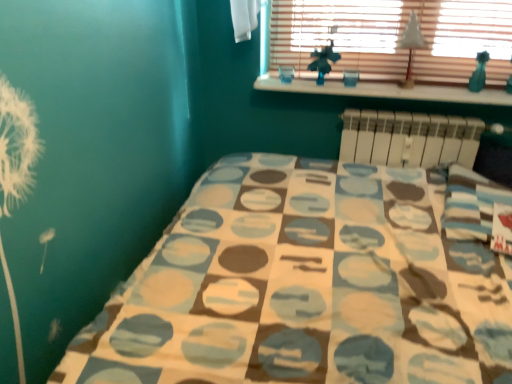
The width and height of the screenshot is (512, 384). I want to click on white paper at upper center, so click(411, 46).

Consider the image. What is the approximate width of white paper at upper center?

white paper at upper center is 2.74 inches in width.

Where is `wooden blinds at upper center`? wooden blinds at upper center is located at coordinates (393, 38).

From the image's perspective, which is above, white plastic radiator at upper right or white wood at upper center?

white wood at upper center appears higher in the image.

Is white plastic radiator at upper right to the left of white wood at upper center from the viewer's perspective?

No, white plastic radiator at upper right is not to the left of white wood at upper center.

Is white plastic radiator at upper right directly adjacent to white wood at upper center?

No, white plastic radiator at upper right is not with white wood at upper center.

Is white plastic radiator at upper right thinner than white wood at upper center?

Indeed, white plastic radiator at upper right has a lesser width compared to white wood at upper center.

Does white wood at upper center contain white plastic radiator at upper right?

No, white plastic radiator at upper right is not a part of white wood at upper center.

In terms of height, does white wood at upper center look taller or shorter compared to white plastic radiator at upper right?

Considering their sizes, white wood at upper center has less height than white plastic radiator at upper right.

Consider the image. Considering the positions of objects white wood at upper center and white plastic radiator at upper right in the image provided, who is behind, white wood at upper center or white plastic radiator at upper right?

Positioned behind is white plastic radiator at upper right.

Find the location of `radiator on the right of white wood at upper center`. radiator on the right of white wood at upper center is located at coordinates (409, 138).

Image resolution: width=512 pixels, height=384 pixels. In order to click on lamp above the white wood at upper center (from the image's perspective) in this screenshot , I will do `click(411, 46)`.

Is white wood at upper center positioned beyond the bounds of white paper at upper center?

white wood at upper center is positioned outside white paper at upper center.

Could you tell me if white wood at upper center is turned towards white paper at upper center?

No, white wood at upper center is not aimed at white paper at upper center.

Is white paper at upper center positioned far away from white plastic radiator at upper right?

They are positioned close to each other.

From the image's perspective, is white paper at upper center above or below white plastic radiator at upper right?

white paper at upper center is above white plastic radiator at upper right.

From a real-world perspective, who is located lower, white paper at upper center or white plastic radiator at upper right?

white plastic radiator at upper right, from a real-world perspective.

Which is behind, wooden blinds at upper center or white wood at upper center?

white wood at upper center.

What's the angular difference between wooden blinds at upper center and white wood at upper center's facing directions?

wooden blinds at upper center and white wood at upper center are facing 0.12 degrees away from each other.

In the scene shown: Can you see wooden blinds at upper center touching white wood at upper center?

wooden blinds at upper center is not next to white wood at upper center, and they're not touching.

Does point (430, 5) lie in front of point (407, 96)?

Yes, point (430, 5) is closer to viewer.

From a real-world perspective, relative to white paper at upper center, is wooden blinds at upper center vertically above or below?

Clearly, from a real-world perspective, wooden blinds at upper center is above white paper at upper center.

Does point (435, 53) come closer to viewer compared to point (409, 54)?

Yes, it is in front of point (409, 54).

Can we say wooden blinds at upper center lies outside white paper at upper center?

Yes, wooden blinds at upper center is not within white paper at upper center.

Does white wood at upper center turn towards wooden blinds at upper center?

No, white wood at upper center is not facing towards wooden blinds at upper center.

Between white wood at upper center and wooden blinds at upper center, which one has less height?

With less height is white wood at upper center.

Which is correct: white wood at upper center is inside wooden blinds at upper center, or outside of it?

white wood at upper center is located beyond the bounds of wooden blinds at upper center.

Between white wood at upper center and wooden blinds at upper center, which one has larger width?

With larger width is white wood at upper center.

The width and height of the screenshot is (512, 384). Find the location of `radiator that is below the white wood at upper center (from the image's perspective)`. radiator that is below the white wood at upper center (from the image's perspective) is located at coordinates (409, 138).

I want to click on window sill in front of the white plastic radiator at upper right, so click(386, 91).

Which object lies nearer to the anchor point white paper at upper center, wooden blinds at upper center or white wood at upper center?

wooden blinds at upper center.

Considering their positions, is wooden blinds at upper center positioned further to white plastic radiator at upper right than white wood at upper center?

wooden blinds at upper center.

From the picture: From the image, which object appears to be farther from wooden blinds at upper center, white plastic radiator at upper right or white wood at upper center?

Among the two, white plastic radiator at upper right is located further to wooden blinds at upper center.

Based on their spatial positions, is white plastic radiator at upper right or wooden blinds at upper center further from white paper at upper center?

Among the two, white plastic radiator at upper right is located further to white paper at upper center.

Which object lies further to the anchor point white paper at upper center, white wood at upper center or white plastic radiator at upper right?

The object further to white paper at upper center is white plastic radiator at upper right.

Estimate the real-world distances between objects in this image. Which object is further from wooden blinds at upper center, white wood at upper center or white plastic radiator at upper right?

white plastic radiator at upper right is further to wooden blinds at upper center.

Estimate the real-world distances between objects in this image. Which object is closer to white paper at upper center, wooden blinds at upper center or white plastic radiator at upper right?

The object closer to white paper at upper center is wooden blinds at upper center.

When comparing their distances from wooden blinds at upper center, does white plastic radiator at upper right or white paper at upper center seem further?

white plastic radiator at upper right is positioned further to the anchor wooden blinds at upper center.

Locate an element on the screen. window sill between wooden blinds at upper center and white plastic radiator at upper right from top to bottom is located at coordinates (386, 91).

The image size is (512, 384). Find the location of `lamp between wooden blinds at upper center and white wood at upper center in the up-down direction`. lamp between wooden blinds at upper center and white wood at upper center in the up-down direction is located at coordinates (411, 46).

This screenshot has height=384, width=512. In order to click on lamp between wooden blinds at upper center and white plastic radiator at upper right from top to bottom in this screenshot , I will do 411,46.

This screenshot has width=512, height=384. Find the location of `window sill between white paper at upper center and white plastic radiator at upper right in the vertical direction`. window sill between white paper at upper center and white plastic radiator at upper right in the vertical direction is located at coordinates (386, 91).